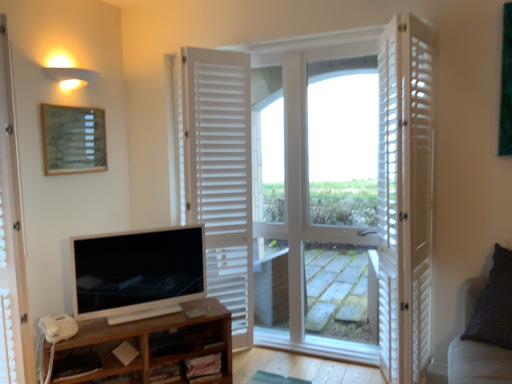
The image size is (512, 384). Describe the element at coordinates (220, 175) in the screenshot. I see `white wooden door at center, the first door in the left-to-right sequence` at that location.

The height and width of the screenshot is (384, 512). Describe the element at coordinates (478, 363) in the screenshot. I see `dark gray fabric couch at right` at that location.

Find the location of a particular element. This screenshot has width=512, height=384. white plastic phone at lower left is located at coordinates (58, 327).

In the scene shown: What is the approximate height of white glossy television at lower left?

19.60 inches.

Measure the distance between matte wooden picture frame at upper left and camera.

matte wooden picture frame at upper left is 8.13 feet from camera.

Where is `white wooden door at center, placed as the 3th door when sorted from right to left`? white wooden door at center, placed as the 3th door when sorted from right to left is located at coordinates (220, 175).

Considering the positions of points (71, 170) and (64, 58), is point (71, 170) closer to camera compared to point (64, 58)?

No, (71, 170) is further to viewer.

Can you confirm if matte wooden picture frame at upper left is taller than matte white sconce at upper left?

Yes, matte wooden picture frame at upper left is taller than matte white sconce at upper left.

Is matte wooden picture frame at upper left completely or partially outside of matte white sconce at upper left?

Absolutely, matte wooden picture frame at upper left is external to matte white sconce at upper left.

Does white wooden door at center, acting as the 2th door starting from the right, turn towards matte white sconce at upper left?

No, white wooden door at center, acting as the 2th door starting from the right, does not turn towards matte white sconce at upper left.

Is white wooden door at center, arranged as the second door when viewed from the left, to the left of matte white sconce at upper left from the viewer's perspective?

No, white wooden door at center, arranged as the second door when viewed from the left, is not to the left of matte white sconce at upper left.

From a real-world perspective, does white wooden door at center, arranged as the second door when viewed from the left, sit lower than matte white sconce at upper left?

Yes, from a real-world perspective, white wooden door at center, arranged as the second door when viewed from the left, is beneath matte white sconce at upper left.

From the picture: Measure the distance from white wooden door at right, which is the first door in right-to-left order, to brown wood shelf at lower left.

They are 4.29 feet apart.

Based on their sizes in the image, would you say white wooden door at right, the third door positioned from the left, is bigger or smaller than brown wood shelf at lower left?

In the image, white wooden door at right, the third door positioned from the left, appears to be larger than brown wood shelf at lower left.

Image resolution: width=512 pixels, height=384 pixels. What are the coordinates of `shelf behind the white wooden door at right, which is the first door in right-to-left order` in the screenshot? It's located at (150, 344).

From a real-world perspective, who is located lower, white wooden door at right, the third door positioned from the left, or brown wood shelf at lower left?

brown wood shelf at lower left, from a real-world perspective.

Is white wooden door at center, placed as the 3th door when sorted from right to left, located outside white plastic phone at lower left?

white wooden door at center, placed as the 3th door when sorted from right to left, lies outside white plastic phone at lower left's area.

Is white wooden door at center, placed as the 3th door when sorted from right to left, oriented away from white plastic phone at lower left?

That's not correct — white wooden door at center, placed as the 3th door when sorted from right to left, is not looking away from white plastic phone at lower left.

Which is more to the left, white wooden door at center, placed as the 3th door when sorted from right to left, or white plastic phone at lower left?

Positioned to the left is white plastic phone at lower left.

Between white glossy television at lower left and white wooden door at center, arranged as the second door when viewed from the left, which one is positioned behind?

white wooden door at center, arranged as the second door when viewed from the left, is behind.

In the scene shown: Would you consider white glossy television at lower left to be distant from white wooden door at center, arranged as the second door when viewed from the left?

They are positioned close to each other.

Consider the image. What's the angular difference between white glossy television at lower left and white wooden door at center, acting as the 2th door starting from the right,'s facing directions?

The angle between the facing direction of white glossy television at lower left and the facing direction of white wooden door at center, acting as the 2th door starting from the right, is 50 degrees.

Does white plastic phone at lower left have a lesser height compared to matte wooden picture frame at upper left?

Yes.

From a real-world perspective, which is physically above, white plastic phone at lower left or matte wooden picture frame at upper left?

matte wooden picture frame at upper left, from a real-world perspective.

Is white plastic phone at lower left beside matte wooden picture frame at upper left?

They are not placed beside each other.

Who is smaller, white plastic phone at lower left or matte wooden picture frame at upper left?

Smaller between the two is white plastic phone at lower left.

Can you confirm if white glossy television at lower left is thinner than dark gray fabric couch at right?

Indeed, white glossy television at lower left has a lesser width compared to dark gray fabric couch at right.

Considering the sizes of objects white glossy television at lower left and dark gray fabric couch at right in the image provided, who is shorter, white glossy television at lower left or dark gray fabric couch at right?

white glossy television at lower left.

This screenshot has height=384, width=512. In the image, there is a matte white sconce at upper left. In order to click on picture frame below it (from a real-world perspective) in this screenshot , I will do `click(73, 139)`.

Locate an element on the screen. The image size is (512, 384). light fixture above the white wooden door at center, acting as the 2th door starting from the right (from the image's perspective) is located at coordinates (68, 73).

Looking at the image, which one is located closer to white wooden door at center, the first door in the left-to-right sequence, brown wood shelf at lower left or white wooden door at right, the third door positioned from the left?

The object closer to white wooden door at center, the first door in the left-to-right sequence, is brown wood shelf at lower left.

From the image, which object appears to be nearer to white wooden door at right, the third door positioned from the left, white wooden door at center, acting as the 2th door starting from the right, or white plastic phone at lower left?

Among the two, white wooden door at center, acting as the 2th door starting from the right, is located nearer to white wooden door at right, the third door positioned from the left.

Looking at the image, which one is located further to matte wooden picture frame at upper left, dark gray fabric couch at right or brown wood shelf at lower left?

dark gray fabric couch at right is positioned further to the anchor matte wooden picture frame at upper left.

Considering their positions, is white wooden door at center, arranged as the second door when viewed from the left, positioned closer to white plastic phone at lower left than brown wood shelf at lower left?

Among the two, brown wood shelf at lower left is located nearer to white plastic phone at lower left.

Considering their positions, is white wooden door at center, the first door in the left-to-right sequence, positioned closer to white wooden door at right, which is the first door in right-to-left order, than white wooden door at center, acting as the 2th door starting from the right?

white wooden door at center, acting as the 2th door starting from the right, lies closer to white wooden door at right, which is the first door in right-to-left order, than the other object.

Estimate the real-world distances between objects in this image. Which object is closer to dark gray fabric couch at right, white wooden door at center, acting as the 2th door starting from the right, or white plastic phone at lower left?

white wooden door at center, acting as the 2th door starting from the right, is closer to dark gray fabric couch at right.

Based on their spatial positions, is dark gray fabric couch at right or white glossy television at lower left closer to matte wooden picture frame at upper left?

white glossy television at lower left is closer to matte wooden picture frame at upper left.

From the image, which object appears to be farther from white wooden door at right, the third door positioned from the left, brown wood shelf at lower left or dark gray fabric couch at right?

brown wood shelf at lower left is positioned further to the anchor white wooden door at right, the third door positioned from the left.

This screenshot has height=384, width=512. In order to click on corded phone between matte white sconce at upper left and brown wood shelf at lower left from top to bottom in this screenshot , I will do `click(58, 327)`.

You are a GUI agent. You are given a task and a screenshot of the screen. Output one action in this format:
    pyautogui.click(x=<x>, y=<y>)
    Task: Click on the television between white plastic phone at lower left and dark gray fabric couch at right from left to right
    This screenshot has height=384, width=512.
    Given the screenshot: What is the action you would take?
    pyautogui.click(x=138, y=271)

Find the location of `television between matte white sconce at upper left and white wooden door at center, acting as the 2th door starting from the right, from left to right`. television between matte white sconce at upper left and white wooden door at center, acting as the 2th door starting from the right, from left to right is located at coordinates (138, 271).

The height and width of the screenshot is (384, 512). Identify the location of door located between white wooden door at center, acting as the 2th door starting from the right, and dark gray fabric couch at right in the left-right direction. (405, 197).